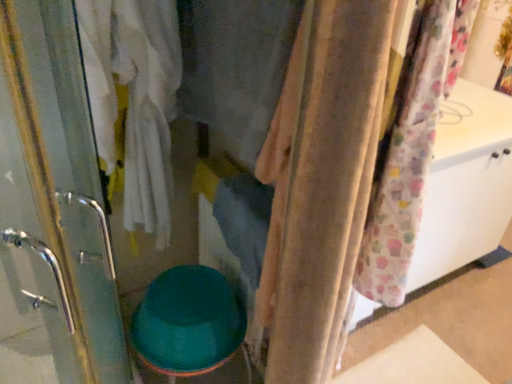
Question: From a real-world perspective, is velvet fabric at center physically located above or below beige fabric curtain at center?

Choices:
 (A) below
 (B) above

Answer: (B)

Question: Is point (260, 49) positioned closer to the camera than point (345, 183)?

Choices:
 (A) farther
 (B) closer

Answer: (A)

Question: Based on their relative distances, which object is nearer to the teal glossy toilet bowl at center?

Choices:
 (A) beige fabric curtain at center
 (B) velvet fabric at center

Answer: (A)

Question: Which object is positioned closest to the beige fabric curtain at center?

Choices:
 (A) teal glossy toilet bowl at center
 (B) velvet fabric at center

Answer: (B)